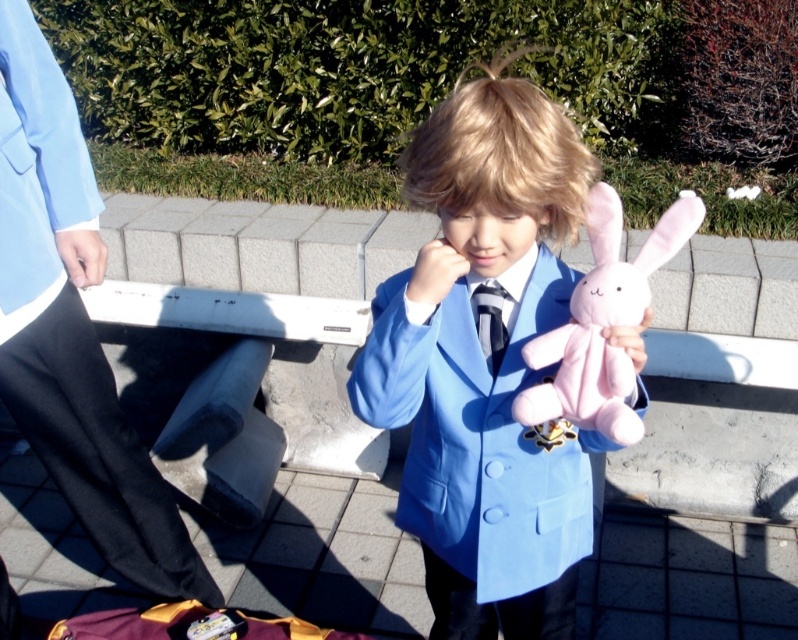
Does matte blue suit at center appear on the left side of matte black tie at center?

Indeed, matte blue suit at center is positioned on the left side of matte black tie at center.

Is matte blue suit at center wider than matte black tie at center?

Yes.

Identify the location of matte blue suit at center. (484, 364).

Locate an element on the screen. Image resolution: width=798 pixels, height=640 pixels. matte blue suit at center is located at coordinates (484, 364).

This screenshot has height=640, width=798. What do you see at coordinates (484, 364) in the screenshot?
I see `matte blue suit at center` at bounding box center [484, 364].

Does point (456, 579) come farther from viewer compared to point (571, 298)?

That is True.

Between point (531, 189) and point (522, 355), which one is positioned behind?

The point (522, 355) is behind.

At what (x,y) coordinates should I click in order to perform the action: click on matte blue suit at center. Please return your answer as a coordinate pair (x, y). This screenshot has height=640, width=798. Looking at the image, I should click on (484, 364).

Does pink plush at center appear on the left side of matte black tie at center?

Incorrect, pink plush at center is not on the left side of matte black tie at center.

This screenshot has width=798, height=640. What do you see at coordinates (603, 323) in the screenshot? I see `pink plush at center` at bounding box center [603, 323].

Does point (658, 234) lie in front of point (492, 288)?

Yes, point (658, 234) is closer to viewer.

Locate an element on the screen. pink plush at center is located at coordinates [x=603, y=323].